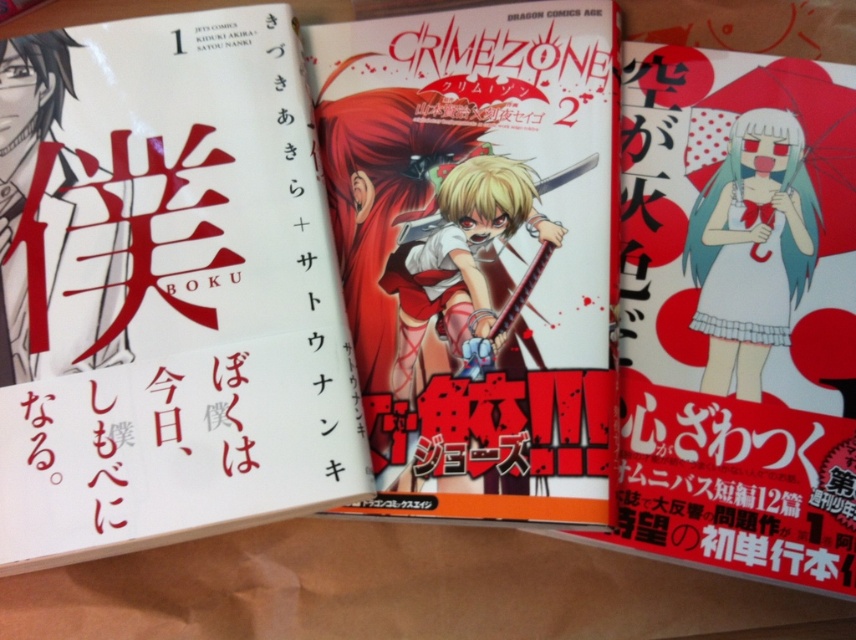
You are organizing a shelf and see the white matte book at center and the matte white manga at center. Which one is positioned lower on the shelf?

The white matte book at center is located below the matte white manga at center, so it is positioned lower on the shelf.

You are a book collector who wants to place a new manga volume on the wooden surface. The current manga volumes are arranged in a straight line from left to right as follows. The white matte book at center is positioned at point 0.453, 0.195. Where should you place the new manga volume to maintain the straight line arrangement?

To maintain the straight line arrangement, the new manga volume should be placed either to the left of the white matte book at center or to the right of it, ensuring it aligns with the existing line formed by the current volumes.